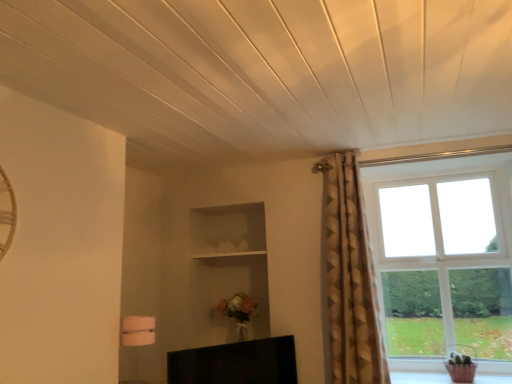
Locate an element on the screen. The width and height of the screenshot is (512, 384). white wooden shelf at center is located at coordinates (229, 256).

Image resolution: width=512 pixels, height=384 pixels. I want to click on black glossy tv at lower center, so click(236, 363).

In order to click on clear glass window at right in this screenshot , I will do `click(436, 232)`.

Which object is positioned more to the right, gold textured curtain at upper right or black glossy tv at lower center?

gold textured curtain at upper right.

Is gold textured curtain at upper right positioned far away from black glossy tv at lower center?

No, gold textured curtain at upper right is in close proximity to black glossy tv at lower center.

This screenshot has height=384, width=512. In order to click on furniture on the left of gold textured curtain at upper right in this screenshot , I will do `click(236, 363)`.

Does point (323, 166) lie in front of point (183, 364)?

That is False.

Considering the sizes of clear glass window at right and gold textured curtain at upper right in the image, is clear glass window at right wider or thinner than gold textured curtain at upper right?

Clearly, clear glass window at right has less width compared to gold textured curtain at upper right.

From the image's perspective, which object appears higher, clear glass window at right or gold textured curtain at upper right?

gold textured curtain at upper right.

Can you confirm if clear glass window at right is smaller than gold textured curtain at upper right?

Indeed, clear glass window at right has a smaller size compared to gold textured curtain at upper right.

From the image's perspective, is clear glass window at right under white wooden shelf at center?

Yes, from the image's perspective, clear glass window at right is below white wooden shelf at center.

Which object is closer to the camera, clear glass window at right or white wooden shelf at center?

clear glass window at right is in front.

Considering the relative sizes of clear glass window at right and white wooden shelf at center in the image provided, is clear glass window at right smaller than white wooden shelf at center?

No.

In the image, is clear glass window at right on the left side or the right side of white wooden shelf at center?

In the image, clear glass window at right appears on the right side of white wooden shelf at center.

Is black glossy tv at lower center completely or partially outside of gold textured curtain at upper right?

black glossy tv at lower center is positioned outside gold textured curtain at upper right.

Looking at their sizes, would you say black glossy tv at lower center is wider or thinner than gold textured curtain at upper right?

In the image, black glossy tv at lower center appears to be more narrow than gold textured curtain at upper right.

Based on the photo, is the depth of black glossy tv at lower center greater than that of gold textured curtain at upper right?

No, black glossy tv at lower center is in front of gold textured curtain at upper right.

Can you confirm if black glossy tv at lower center is bigger than gold textured curtain at upper right?

No.

Based on the photo, measure the distance from gold textured curtain at upper right to white wooden shelf at center.

gold textured curtain at upper right and white wooden shelf at center are 3.30 feet apart.

Is gold textured curtain at upper right not within white wooden shelf at center?

That's correct, gold textured curtain at upper right is outside of white wooden shelf at center.

Between gold textured curtain at upper right and white wooden shelf at center, which one has larger size?

gold textured curtain at upper right is bigger.

In the scene shown: Which object is thinner, gold textured curtain at upper right or white wooden shelf at center?

gold textured curtain at upper right is thinner.

Can you tell me how much white wooden shelf at center and black glossy tv at lower center differ in facing direction?

The facing directions of white wooden shelf at center and black glossy tv at lower center are 52.9 degrees apart.

Which of these two, white wooden shelf at center or black glossy tv at lower center, is thinner?

black glossy tv at lower center.

Is white wooden shelf at center situated inside black glossy tv at lower center or outside?

white wooden shelf at center is not enclosed by black glossy tv at lower center.

From a real-world perspective, is white wooden shelf at center located higher than black glossy tv at lower center?

Yes.

How distant is white wooden shelf at center from clear glass window at right?

white wooden shelf at center is 1.37 meters away from clear glass window at right.

Between white wooden shelf at center and clear glass window at right, which one is positioned in front?

clear glass window at right.

Based on the photo, from a real-world perspective, between white wooden shelf at center and clear glass window at right, who is vertically lower?

clear glass window at right.

Identify the location of shelf above the clear glass window at right (from a real-world perspective). This screenshot has width=512, height=384. (229, 256).

Identify the location of curtain located behind the black glossy tv at lower center. Image resolution: width=512 pixels, height=384 pixels. (348, 279).

Locate an element on the screen. curtain located on the left of clear glass window at right is located at coordinates (348, 279).

Which object lies nearer to the anchor point black glossy tv at lower center, clear glass window at right or white wooden shelf at center?

Among the two, white wooden shelf at center is located nearer to black glossy tv at lower center.

Looking at this image, considering their positions, is clear glass window at right positioned further to white wooden shelf at center than gold textured curtain at upper right?

clear glass window at right is positioned further to the anchor white wooden shelf at center.

From the image, which object appears to be farther from clear glass window at right, white wooden shelf at center or gold textured curtain at upper right?

white wooden shelf at center.

Which object lies further to the anchor point black glossy tv at lower center, clear glass window at right or gold textured curtain at upper right?

clear glass window at right is positioned further to the anchor black glossy tv at lower center.

Estimate the real-world distances between objects in this image. Which object is closer to gold textured curtain at upper right, white wooden shelf at center or black glossy tv at lower center?

black glossy tv at lower center.

Looking at the image, which one is located further to black glossy tv at lower center, white wooden shelf at center or gold textured curtain at upper right?

The object further to black glossy tv at lower center is white wooden shelf at center.

From the image, which object appears to be farther from gold textured curtain at upper right, clear glass window at right or white wooden shelf at center?

white wooden shelf at center lies further to gold textured curtain at upper right than the other object.

Which object lies nearer to the anchor point white wooden shelf at center, gold textured curtain at upper right or black glossy tv at lower center?

gold textured curtain at upper right is closer to white wooden shelf at center.

The image size is (512, 384). Find the location of `curtain between black glossy tv at lower center and clear glass window at right`. curtain between black glossy tv at lower center and clear glass window at right is located at coordinates (348, 279).

What are the coordinates of `curtain located between black glossy tv at lower center and white wooden shelf at center in the depth direction` in the screenshot? It's located at (348, 279).

Where is `curtain located between white wooden shelf at center and clear glass window at right in the left-right direction`? The height and width of the screenshot is (384, 512). curtain located between white wooden shelf at center and clear glass window at right in the left-right direction is located at coordinates (348, 279).

Find the location of `furniture between white wooden shelf at center and clear glass window at right`. furniture between white wooden shelf at center and clear glass window at right is located at coordinates (236, 363).